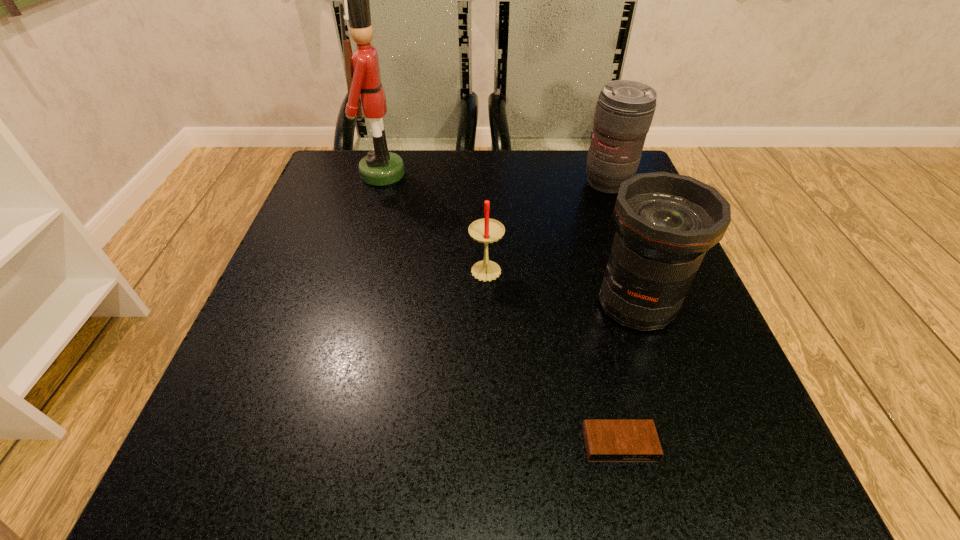
Where is `free space at the far edge of the desktop`? free space at the far edge of the desktop is located at coordinates (391, 204).

Locate an element on the screen. This screenshot has height=540, width=960. vacant space at the near edge of the desktop is located at coordinates coord(327,481).

This screenshot has width=960, height=540. I want to click on free space at the left edge, so click(x=357, y=240).

Image resolution: width=960 pixels, height=540 pixels. I want to click on free space at the right edge of the desktop, so click(x=703, y=371).

The width and height of the screenshot is (960, 540). I want to click on vacant area at the far left corner, so click(359, 155).

This screenshot has height=540, width=960. I want to click on vacant space at the near left corner of the desktop, so click(x=185, y=467).

Locate an element on the screen. This screenshot has height=540, width=960. vacant area that lies between the fourth tallest object and the farther telephoto lens is located at coordinates (547, 228).

Find the location of a particular element. Image resolution: width=960 pixels, height=540 pixels. free space between the nutcracker and the farther telephoto lens is located at coordinates (495, 178).

The width and height of the screenshot is (960, 540). I want to click on empty location between the fourth tallest object and the nutcracker, so click(435, 224).

Find the location of a particular element. Image resolution: width=960 pixels, height=540 pixels. blank region between the second object from left to right and the leftmost object is located at coordinates (435, 224).